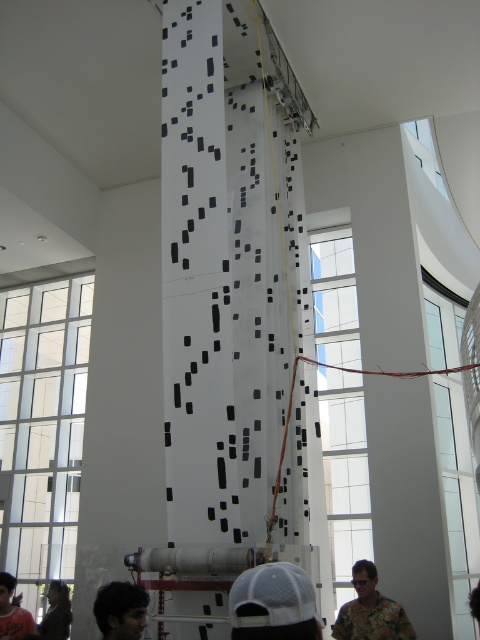
You are an interior designer assessing the space for a client who wants to ensure that the dark brown hair at lower left and dark gray jacket at lower left are visible from the entrance. Given their sizes, which object might be more challenging to see from a distance?

The dark brown hair at lower left has a lesser width compared to the dark gray jacket at lower left, so the dark brown hair at lower left might be more challenging to see from a distance due to its smaller size.

You are standing in the room and want to locate the dark brown hair at lower left. Based on the coordinates provided, where should you look relative to the column?

The dark brown hair at lower left is located at coordinates point (12,611), which is near the bottom right corner of the image. Since the column is the central object, you should look to the far right and slightly downward from the column to find it.